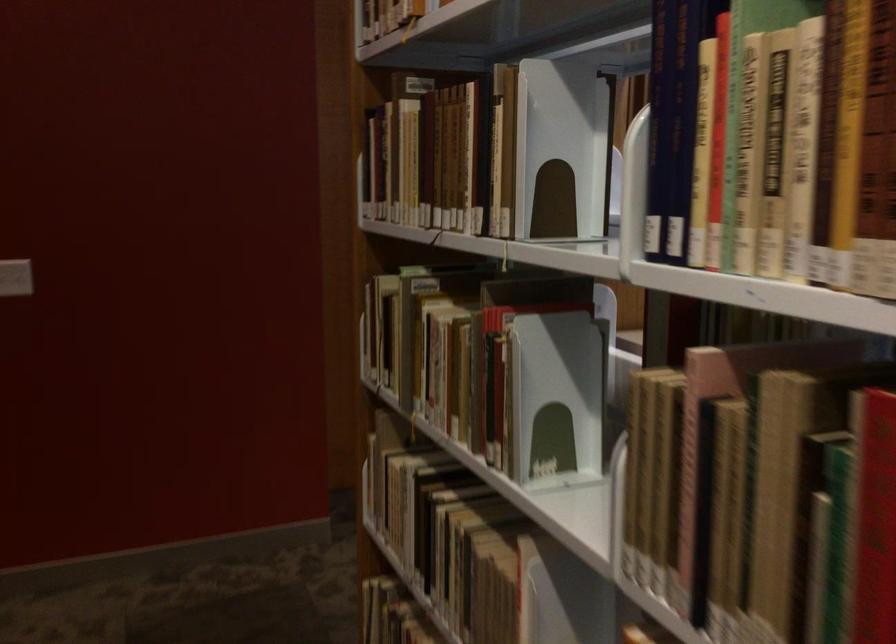
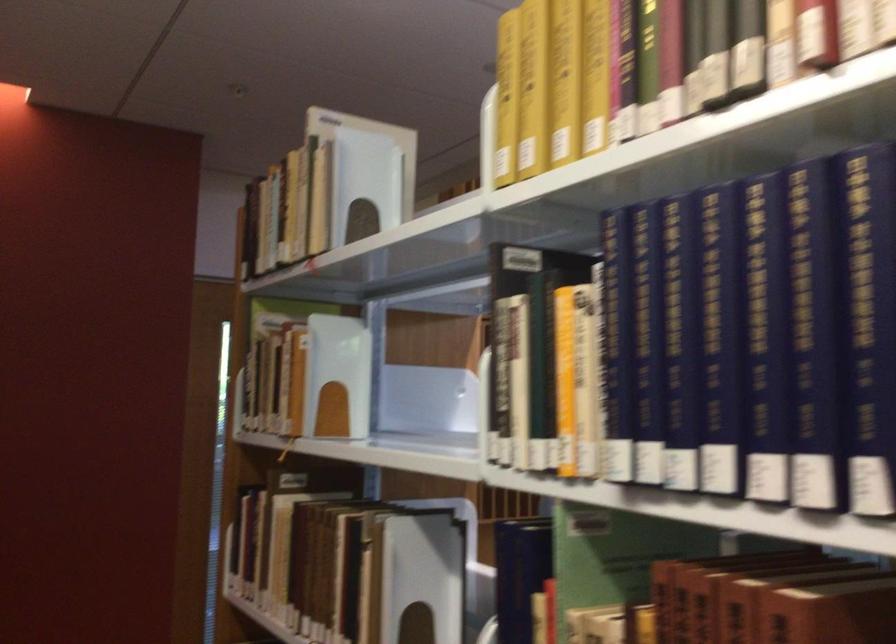
Locate, in the second image, the point that corresponds to (556,133) in the first image.

(417, 581)